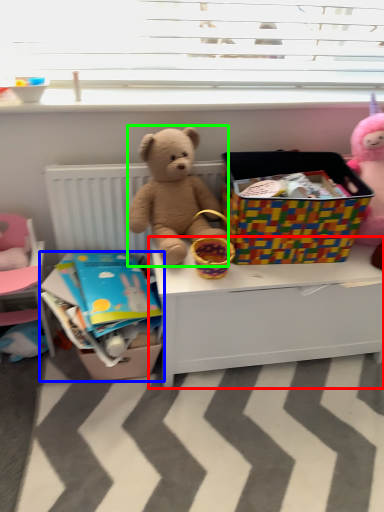
Question: Based on their relative distances, which object is nearer to desk (highlighted by a red box)? Choose from crate (highlighted by a blue box) and teddy bear (highlighted by a green box).

Choices:
 (A) crate
 (B) teddy bear

Answer: (B)